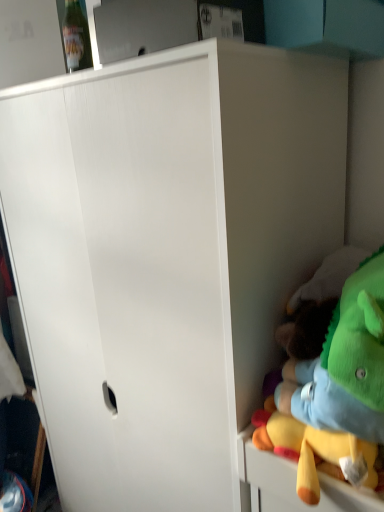
Question: Is transparent plastic bottle at upper left wider or thinner than soft plush toy at right?

Choices:
 (A) thin
 (B) wide

Answer: (A)

Question: Is transparent plastic bottle at upper left spatially inside soft plush toy at right, or outside of it?

Choices:
 (A) outside
 (B) inside

Answer: (A)

Question: From the image's perspective, is transparent plastic bottle at upper left located above or below soft plush toy at right?

Choices:
 (A) below
 (B) above

Answer: (B)

Question: Based on their sizes in the image, would you say soft plush toy at right is bigger or smaller than transparent plastic bottle at upper left?

Choices:
 (A) small
 (B) big

Answer: (B)

Question: Is soft plush toy at right inside or outside of transparent plastic bottle at upper left?

Choices:
 (A) inside
 (B) outside

Answer: (B)

Question: Based on their positions, is soft plush toy at right located to the left or right of transparent plastic bottle at upper left?

Choices:
 (A) right
 (B) left

Answer: (A)

Question: Does point click(x=286, y=395) appear closer or farther from the camera than point click(x=71, y=51)?

Choices:
 (A) farther
 (B) closer

Answer: (B)